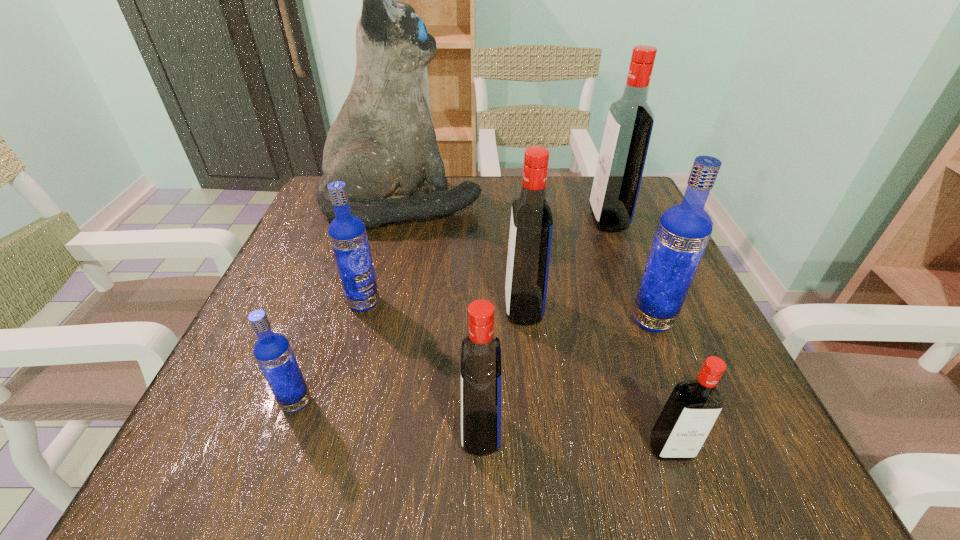
Identify the location of object at the far right corner. (630, 120).

I want to click on object positioned at the near right corner, so click(691, 410).

In the image, there is a desktop. Where is `vacant space at the far edge`? The height and width of the screenshot is (540, 960). vacant space at the far edge is located at coordinates (555, 190).

The height and width of the screenshot is (540, 960). I want to click on vacant region at the near edge, so click(346, 469).

The height and width of the screenshot is (540, 960). Identify the location of vacant space at the left edge of the desktop. click(297, 307).

Where is `vacant region at the right edge of the desktop`? vacant region at the right edge of the desktop is located at coordinates (644, 265).

I want to click on vacant space at the near left corner of the desktop, so click(301, 433).

Where is `vacant space that is in between the fourth vodka from left to right and the sixth vodka from right to left`? vacant space that is in between the fourth vodka from left to right and the sixth vodka from right to left is located at coordinates (444, 306).

What are the coordinates of `free space between the cat and the smallest red vodka` in the screenshot? It's located at (537, 326).

Image resolution: width=960 pixels, height=540 pixels. In order to click on free space between the biggest blue vodka and the farthest vodka in this screenshot , I will do `click(630, 271)`.